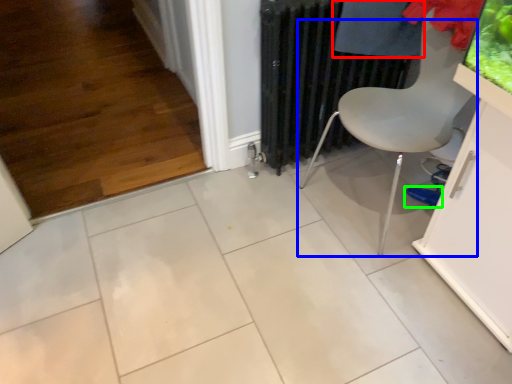
Question: Which object is positioned closest to clothing (highlighted by a red box)? Select from chair (highlighted by a blue box) and footwear (highlighted by a green box).

Choices:
 (A) chair
 (B) footwear

Answer: (A)